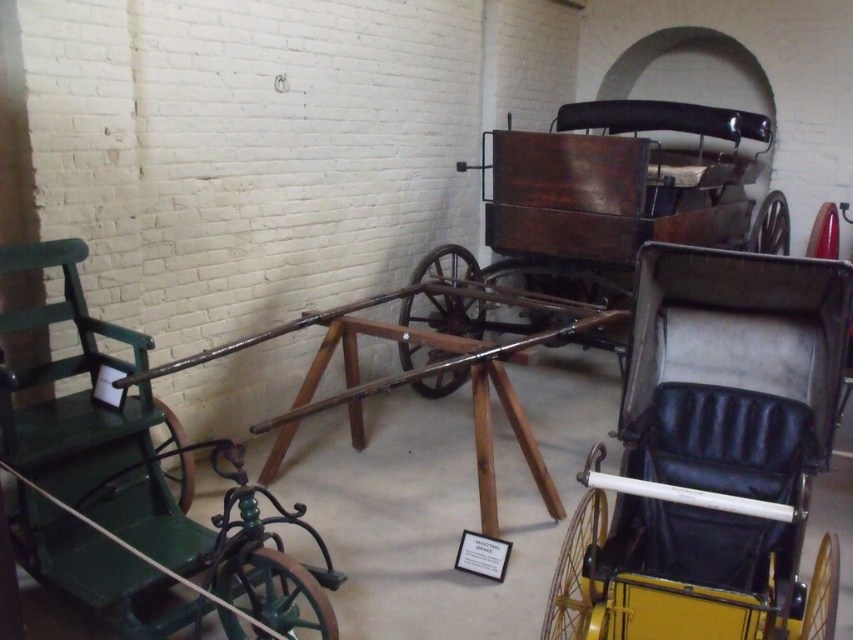
Is yellow leather chair at center to the right of green wrought iron chair at left from the viewer's perspective?

Yes, yellow leather chair at center is to the right of green wrought iron chair at left.

This screenshot has height=640, width=853. What are the coordinates of `yellow leather chair at center` in the screenshot? It's located at (712, 456).

What are the coordinates of `yellow leather chair at center` in the screenshot? It's located at (712, 456).